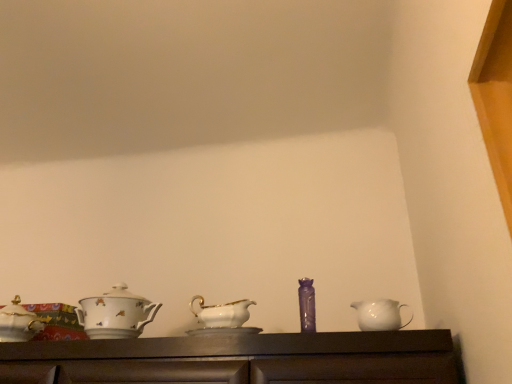
Question: Is white glossy jug at right inside white porcelain teapot at left, which appears as the 2th tableware when viewed from the right?

Choices:
 (A) no
 (B) yes

Answer: (A)

Question: Is white porcelain teapot at left, which ranks as the first tableware in left-to-right order, positioned in front of white glossy jug at right?

Choices:
 (A) yes
 (B) no

Answer: (B)

Question: From a real-world perspective, does white porcelain teapot at left, which appears as the 2th tableware when viewed from the right, stand above white glossy jug at right?

Choices:
 (A) yes
 (B) no

Answer: (A)

Question: Is white porcelain teapot at left, which appears as the 2th tableware when viewed from the right, turned away from white glossy jug at right?

Choices:
 (A) no
 (B) yes

Answer: (A)

Question: From the image's perspective, is white porcelain teapot at left, which ranks as the first tableware in left-to-right order, beneath white glossy jug at right?

Choices:
 (A) no
 (B) yes

Answer: (B)

Question: Is white porcelain teapot at left, which ranks as the first tableware in left-to-right order, shorter than white glossy jug at right?

Choices:
 (A) no
 (B) yes

Answer: (A)

Question: Is white glossy jug at right closer to camera compared to white porcelain teapot at left, which appears as the 2th tableware when viewed from the right?

Choices:
 (A) no
 (B) yes

Answer: (B)

Question: From a real-world perspective, is white glossy jug at right located higher than white porcelain teapot at left, which ranks as the first tableware in left-to-right order?

Choices:
 (A) yes
 (B) no

Answer: (B)

Question: Considering the relative positions of white glossy jug at right and white porcelain teapot at left, which ranks as the first tableware in left-to-right order, in the image provided, is white glossy jug at right to the right of white porcelain teapot at left, which ranks as the first tableware in left-to-right order, from the viewer's perspective?

Choices:
 (A) yes
 (B) no

Answer: (A)

Question: Does white glossy jug at right have a smaller size compared to white porcelain teapot at left, which ranks as the first tableware in left-to-right order?

Choices:
 (A) yes
 (B) no

Answer: (A)

Question: Considering the relative sizes of white glossy jug at right and white porcelain teapot at left, which appears as the 2th tableware when viewed from the right, in the image provided, is white glossy jug at right shorter than white porcelain teapot at left, which appears as the 2th tableware when viewed from the right,?

Choices:
 (A) yes
 (B) no

Answer: (A)

Question: Does white glossy jug at right lie behind white porcelain teapot at left, which ranks as the first tableware in left-to-right order?

Choices:
 (A) yes
 (B) no

Answer: (B)

Question: Is white porcelain teapot at left, which appears as the 2th tableware when viewed from the right, aimed at purple glass vase at center, which appears as the 2th tableware when viewed from the left?

Choices:
 (A) yes
 (B) no

Answer: (B)